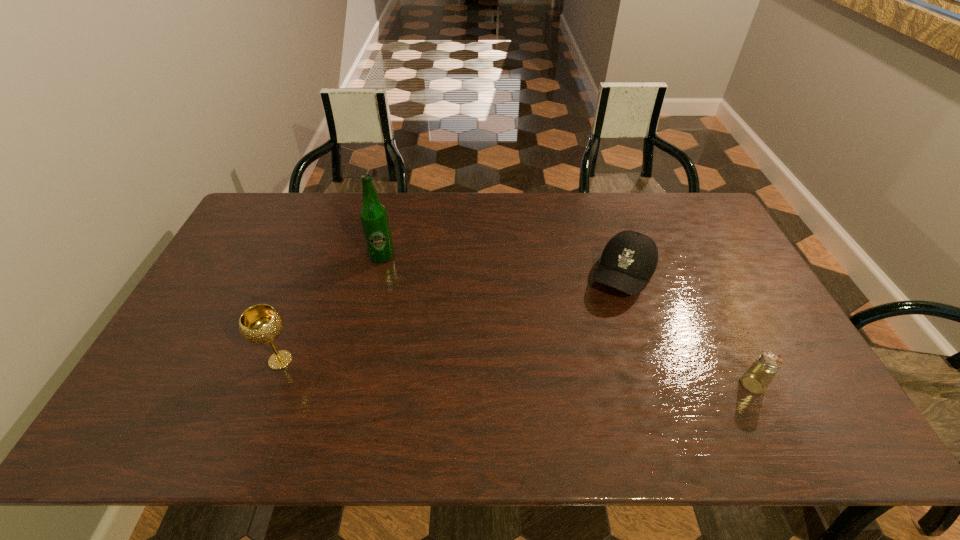
Find the location of a particular element. The width and height of the screenshot is (960, 540). vacant area that lies between the third object from right to left and the rightmost object is located at coordinates (567, 320).

You are a GUI agent. You are given a task and a screenshot of the screen. Output one action in this format:
    pyautogui.click(x=<x>, y=<y>)
    Task: Click on the free spot between the tallest object and the leftmost object
    
    Given the screenshot: What is the action you would take?
    pyautogui.click(x=331, y=308)

The image size is (960, 540). I want to click on blank region between the rightmost object and the third shortest object, so click(x=516, y=373).

Locate an element on the screen. The image size is (960, 540). the second closest object relative to the beer bottle is located at coordinates (629, 259).

Identify which object is the second closest to the second object from left to right. Please provide its 2D coordinates. Your answer should be formatted as a tuple, i.e. [(x, y)], where the tuple contains the x and y coordinates of a point satisfying the conditions above.

[(629, 259)]

You are a GUI agent. You are given a task and a screenshot of the screen. Output one action in this format:
    pyautogui.click(x=<x>, y=<y>)
    Task: Click on the vacant space that satisfies the following two spatial constraints: 1. on the back side of the second object from left to right; 2. on the left side of the second tallest object
    The height and width of the screenshot is (540, 960).
    Given the screenshot: What is the action you would take?
    pyautogui.click(x=321, y=256)